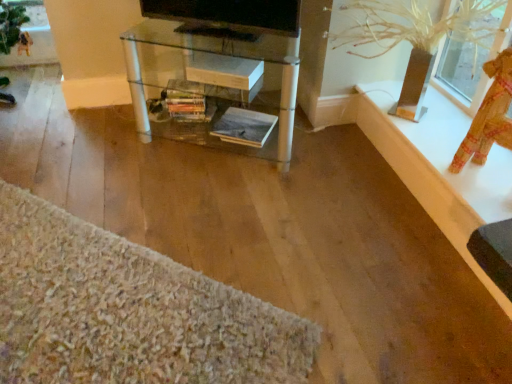
Question: From the image's perspective, is textured beige rug at lower left beneath clear glass table at center?

Choices:
 (A) no
 (B) yes

Answer: (B)

Question: From a real-world perspective, is textured beige rug at lower left positioned over clear glass table at center based on gravity?

Choices:
 (A) yes
 (B) no

Answer: (B)

Question: Does textured beige rug at lower left contain clear glass table at center?

Choices:
 (A) yes
 (B) no

Answer: (B)

Question: Is textured beige rug at lower left bigger than clear glass table at center?

Choices:
 (A) yes
 (B) no

Answer: (B)

Question: Is textured beige rug at lower left at the right side of clear glass table at center?

Choices:
 (A) no
 (B) yes

Answer: (A)

Question: From the image's perspective, does textured beige rug at lower left appear higher than clear glass table at center?

Choices:
 (A) yes
 (B) no

Answer: (B)

Question: Is clear plastic vase at upper right thinner than black glossy tv at upper center?

Choices:
 (A) no
 (B) yes

Answer: (A)

Question: Is clear plastic vase at upper right at the left side of black glossy tv at upper center?

Choices:
 (A) no
 (B) yes

Answer: (A)

Question: Is clear plastic vase at upper right bigger than black glossy tv at upper center?

Choices:
 (A) yes
 (B) no

Answer: (A)

Question: From the image's perspective, would you say clear plastic vase at upper right is positioned over black glossy tv at upper center?

Choices:
 (A) no
 (B) yes

Answer: (A)

Question: Is clear plastic vase at upper right taller than black glossy tv at upper center?

Choices:
 (A) no
 (B) yes

Answer: (B)

Question: Is clear plastic vase at upper right in contact with black glossy tv at upper center?

Choices:
 (A) yes
 (B) no

Answer: (B)

Question: Can you confirm if clear glass table at center is taller than textured fabric doll at upper right?

Choices:
 (A) yes
 (B) no

Answer: (A)